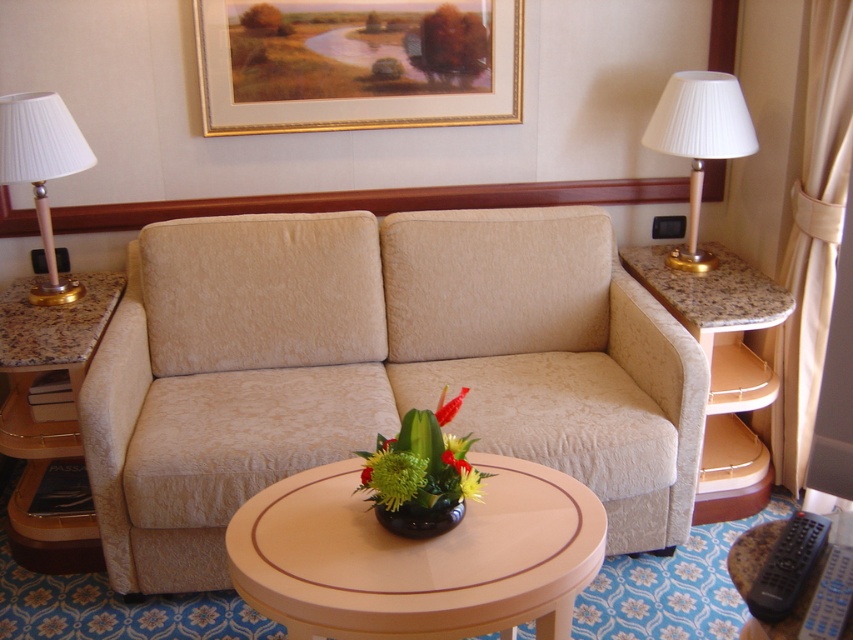
Question: Does granite/stone side table at right have a lesser width compared to matte black vase at center?

Choices:
 (A) no
 (B) yes

Answer: (A)

Question: Considering the real-world distances, which object is farthest from the gold-framed painting at upper center?

Choices:
 (A) matte black vase at center
 (B) matte beige table at center
 (C) granite side table at left

Answer: (A)

Question: Which point is closer to the camera?

Choices:
 (A) (732, 550)
 (B) (515, 90)
 (C) (427, 524)

Answer: (A)

Question: Among these objects, which one is nearest to the camera?

Choices:
 (A) white fabric lampshade at right
 (B) green matte flower at center
 (C) green matte floral arrangement at center
 (D) matte beige table at center

Answer: (D)

Question: Is matte beige table at center to the left of green fabric flower at center from the viewer's perspective?

Choices:
 (A) no
 (B) yes

Answer: (B)

Question: Can you confirm if beige fabric couch at center is bigger than green matte floral arrangement at center?

Choices:
 (A) no
 (B) yes

Answer: (B)